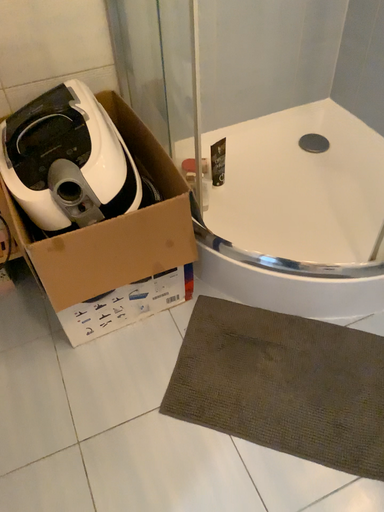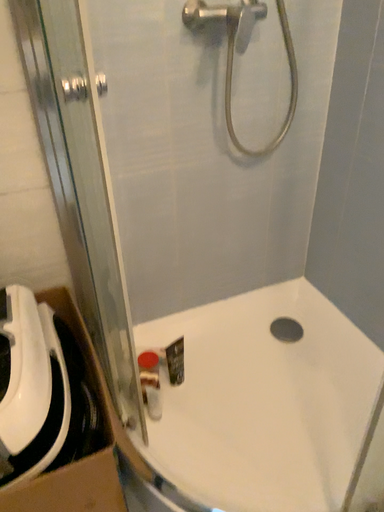
Question: How did the camera likely rotate when shooting the video?

Choices:
 (A) rotated upward
 (B) rotated downward

Answer: (A)